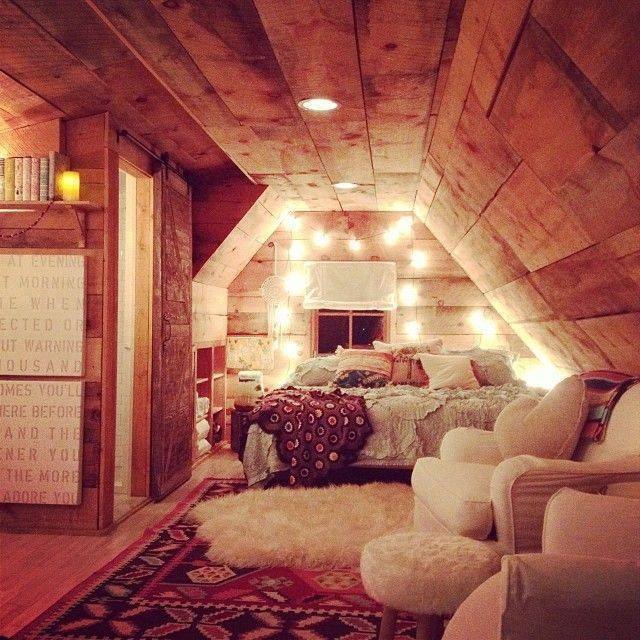
Identify the location of row of books. This screenshot has width=640, height=640. (48, 175), (8, 173).